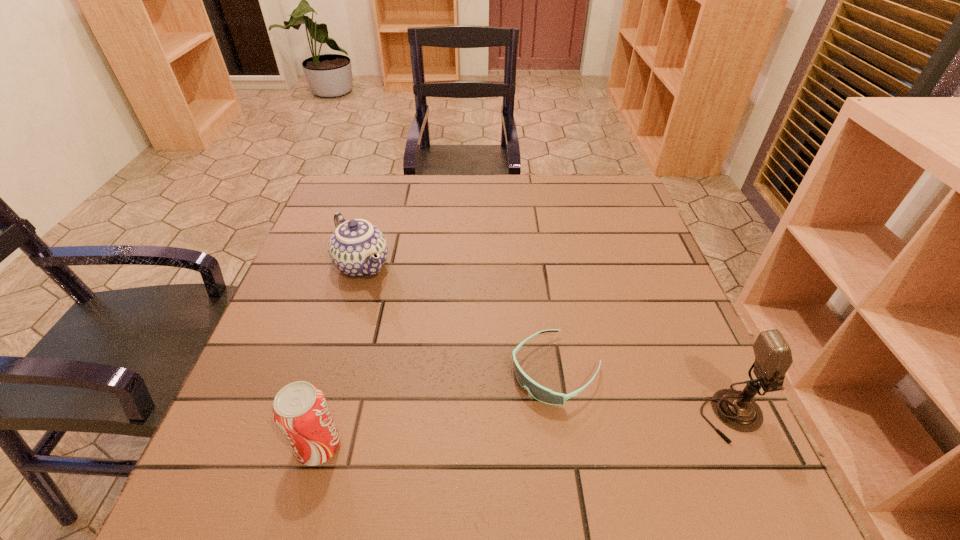
At what (x,y) coordinates should I click in order to perform the action: click on object located at the near right corner. Please return your answer as a coordinate pair (x, y). Looking at the image, I should click on (773, 357).

Identify the location of free location at the far edge of the desktop. The height and width of the screenshot is (540, 960). (552, 209).

This screenshot has width=960, height=540. In the image, there is a desktop. Identify the location of free space at the near edge. (393, 428).

At what (x,y) coordinates should I click in order to perform the action: click on free region at the left edge of the desktop. Please return your answer as a coordinate pair (x, y). Looking at the image, I should click on (284, 361).

Find the location of a particular element. The width and height of the screenshot is (960, 540). vacant space at the right edge of the desktop is located at coordinates (609, 240).

Find the location of a particular element. This screenshot has height=540, width=960. vacant space at the far left corner of the desktop is located at coordinates (349, 213).

In the image, there is a desktop. Where is `vacant space at the near left corner`? vacant space at the near left corner is located at coordinates (245, 410).

Where is `empty space that is in between the second object from right to left and the soda can`? Image resolution: width=960 pixels, height=540 pixels. empty space that is in between the second object from right to left and the soda can is located at coordinates (438, 408).

You are a GUI agent. You are given a task and a screenshot of the screen. Output one action in this format:
    pyautogui.click(x=<x>, y=<y>)
    Task: Click on the free space between the rightmost object and the soda can
    
    Given the screenshot: What is the action you would take?
    click(525, 431)

Identify the location of vacant point located between the third object from left to right and the soda can. (438, 408).